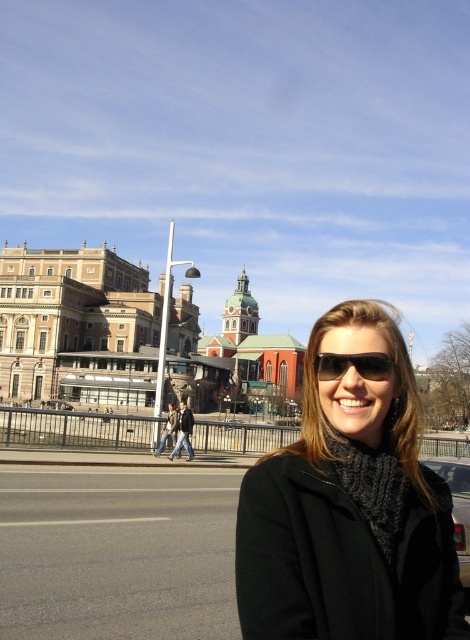
Question: Can you confirm if black woolen scarf at center is positioned below black leather jacket at center?

Choices:
 (A) no
 (B) yes

Answer: (A)

Question: Which of the following is the farthest from the observer?

Choices:
 (A) (329, 456)
 (B) (453, 480)
 (C) (51, 406)

Answer: (C)

Question: In this image, where is black matte car at lower right located relative to black plastic sunglasses at center?

Choices:
 (A) below
 (B) above

Answer: (A)

Question: Based on their relative distances, which object is nearer to the black leather jacket at center?

Choices:
 (A) black woolen scarf at center
 (B) black plastic sunglasses at center

Answer: (A)

Question: Which is farther from the black leather jacket at center?

Choices:
 (A) black plastic sunglasses at center
 (B) black matte car at lower right

Answer: (A)

Question: Is black leather jacket at center above silver metallic car at center?

Choices:
 (A) yes
 (B) no

Answer: (B)